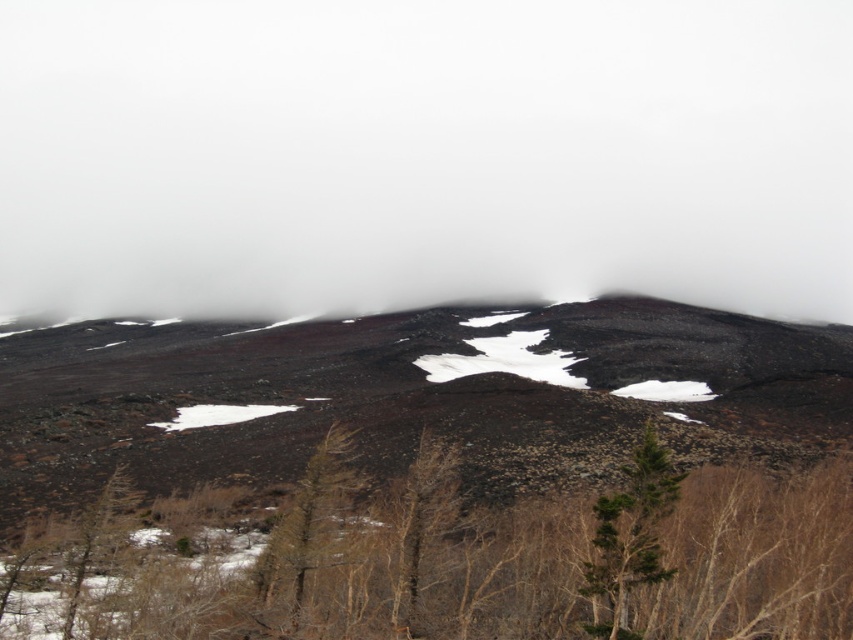
Is dark brown rocky mountain at center behind brown matte tree at lower center?

Yes, it is.

Does dark brown rocky mountain at center have a greater height compared to brown matte tree at lower center?

Yes.

Identify the location of dark brown rocky mountain at center. The height and width of the screenshot is (640, 853). (413, 396).

How far apart are brown textured tree at center and brown matte tree at lower center?

brown textured tree at center is 5.81 meters away from brown matte tree at lower center.

Between brown textured tree at center and brown matte tree at lower center, which one has more height?

brown textured tree at center

Find the location of a particular element. The width and height of the screenshot is (853, 640). brown textured tree at center is located at coordinates (447, 560).

Which of these two, brown textured tree at center or green leafy tree at center, stands taller?

With more height is brown textured tree at center.

Is brown textured tree at center closer to the viewer compared to green leafy tree at center?

Yes.

What do you see at coordinates (447, 560) in the screenshot? I see `brown textured tree at center` at bounding box center [447, 560].

Where is `brown textured tree at center`? brown textured tree at center is located at coordinates (447, 560).